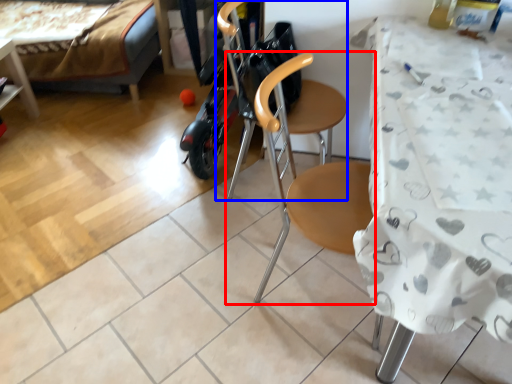
Question: Which of the following is the closest to the observer, chair (highlighted by a red box) or swivel chair (highlighted by a blue box)?

Choices:
 (A) chair
 (B) swivel chair

Answer: (A)